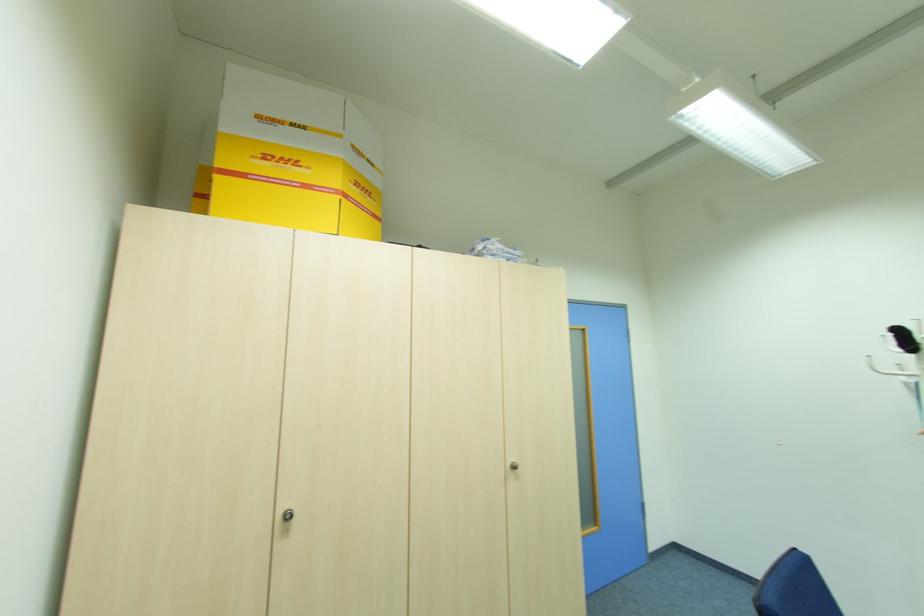
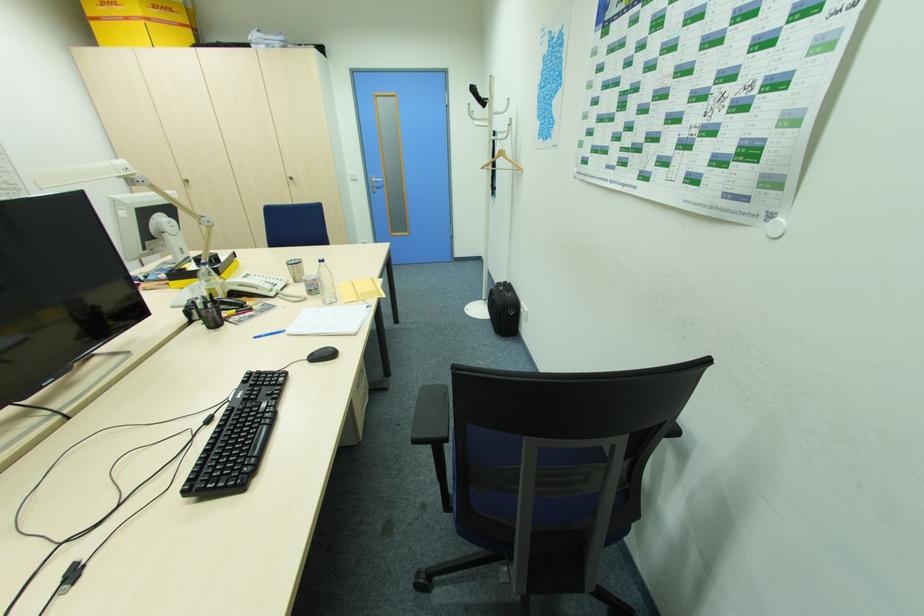
Locate, in the second image, the point that corresponds to [513,460] in the first image.

(292, 176)